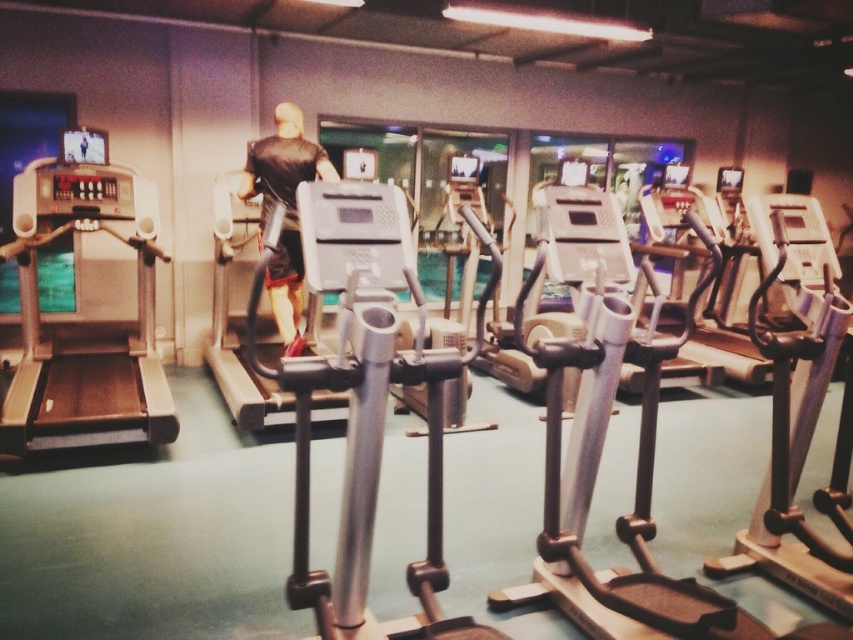
Question: Does matte black treadmill at center appear on the right side of silver metallic treadmill at center?

Choices:
 (A) yes
 (B) no

Answer: (B)

Question: Is silver metallic treadmill at left behind matte black treadmill at center?

Choices:
 (A) yes
 (B) no

Answer: (B)

Question: Is the position of silver metallic treadmill at left less distant than that of silver metallic treadmill at center?

Choices:
 (A) no
 (B) yes

Answer: (B)

Question: Based on their relative distances, which object is farther from the silver metallic treadmill at left?

Choices:
 (A) silver metallic treadmill at center
 (B) matte black treadmill at center

Answer: (A)

Question: Among these objects, which one is farthest from the camera?

Choices:
 (A) matte black treadmill at center
 (B) silver metallic treadmill at center

Answer: (B)

Question: Which object is the farthest from the matte black treadmill at center?

Choices:
 (A) silver metallic treadmill at left
 (B) silver metallic treadmill at center

Answer: (B)